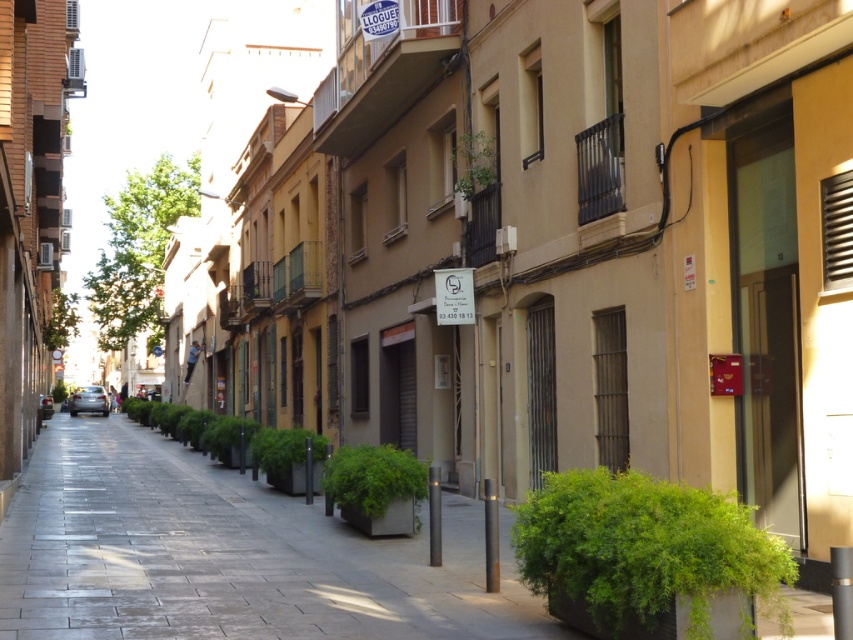
Can you confirm if green leafy plant at center is bigger than green leafy plant at upper center?

Correct, green leafy plant at center is larger in size than green leafy plant at upper center.

The image size is (853, 640). Describe the element at coordinates (643, 548) in the screenshot. I see `green leafy plant at center` at that location.

Between point (627, 499) and point (460, 148), which one is positioned in front?

Positioned in front is point (627, 499).

The image size is (853, 640). Identify the location of green leafy plant at center. (643, 548).

Identify the location of green leafy planter at center. (374, 476).

The width and height of the screenshot is (853, 640). Find the location of `green leafy planter at center`. green leafy planter at center is located at coordinates (374, 476).

Between point (596, 582) and point (368, 456), which one is positioned in front?

Positioned in front is point (596, 582).

Does green leafy plant at center have a larger size compared to green leafy planter at center?

Correct, green leafy plant at center is larger in size than green leafy planter at center.

At what (x,y) coordinates should I click in order to perform the action: click on green leafy plant at center. Please return your answer as a coordinate pair (x, y). This screenshot has height=640, width=853. Looking at the image, I should click on (643, 548).

At what (x,y) coordinates should I click in order to perform the action: click on green leafy plant at center. Please return your answer as a coordinate pair (x, y). Image resolution: width=853 pixels, height=640 pixels. Looking at the image, I should click on (643, 548).